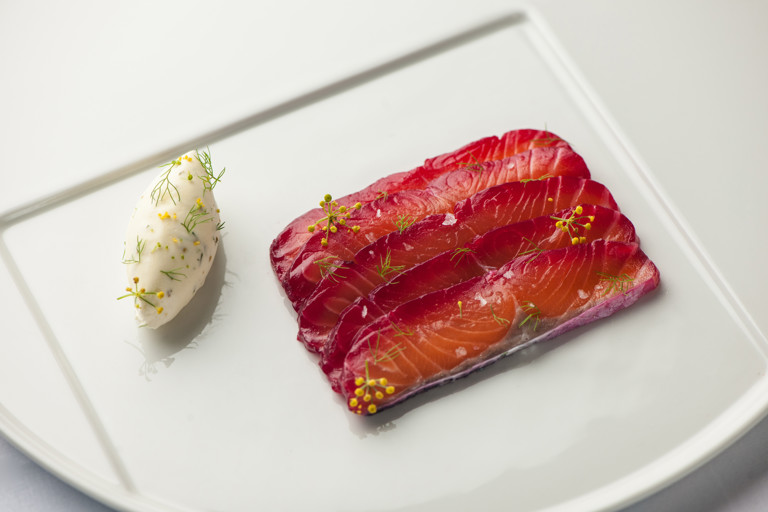
At what (x,y) coordinates should I click in order to perform the action: click on white countertop. Please return your answer as a coordinate pair (x, y). This screenshot has height=512, width=768. Looking at the image, I should click on (27, 487), (727, 481).